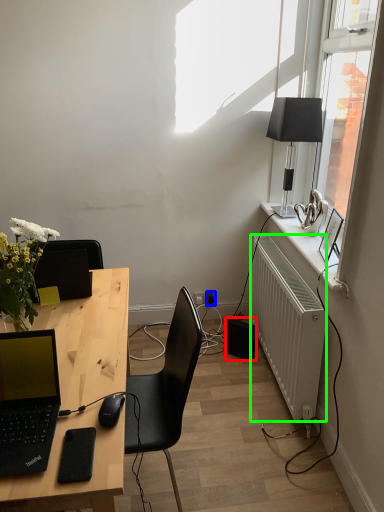
Question: Which object is the farthest from speaker (highlighted by a red box)? Choose among these: power outlet (highlighted by a blue box) or radiator (highlighted by a green box).

Choices:
 (A) power outlet
 (B) radiator

Answer: (B)